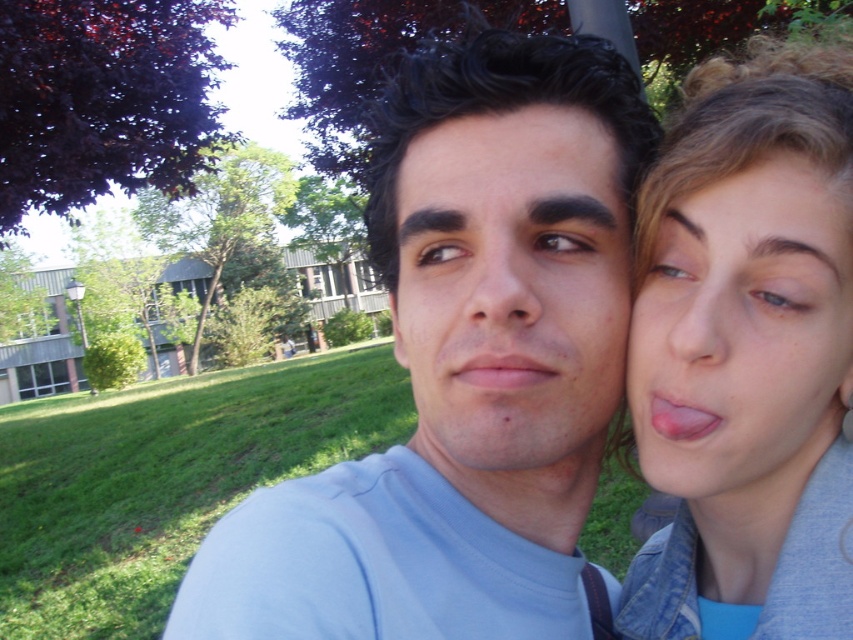
Question: Is the position of matte gray jacket at right less distant than that of matte skin face at center?

Choices:
 (A) no
 (B) yes

Answer: (A)

Question: Among these points, which one is farthest from the camera?

Choices:
 (A) (519, 244)
 (B) (520, 168)
 (C) (520, 371)

Answer: (B)

Question: Estimate the real-world distances between objects in this image. Which object is farther from the light blue t-shirt at center?

Choices:
 (A) matte skin face at center
 (B) matte skin forehead at center

Answer: (B)

Question: Does matte gray jacket at right have a greater width compared to matte skin forehead at center?

Choices:
 (A) no
 (B) yes

Answer: (B)

Question: Does light blue t-shirt at center appear on the right side of matte skin forehead at center?

Choices:
 (A) yes
 (B) no

Answer: (B)

Question: Among these points, which one is nearest to the camera?

Choices:
 (A) (427, 144)
 (B) (440, 436)

Answer: (B)